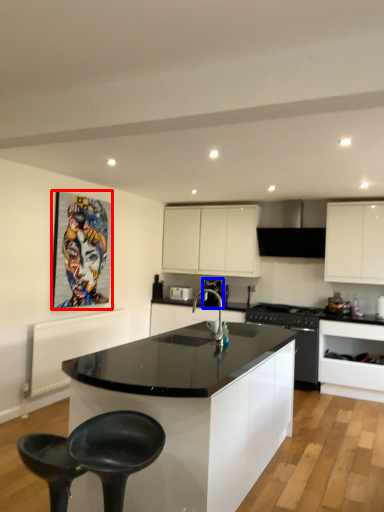
Question: Which of the following is the farthest to the observer, picture frame (highlighted by a red box) or coffee machine (highlighted by a blue box)?

Choices:
 (A) picture frame
 (B) coffee machine

Answer: (B)